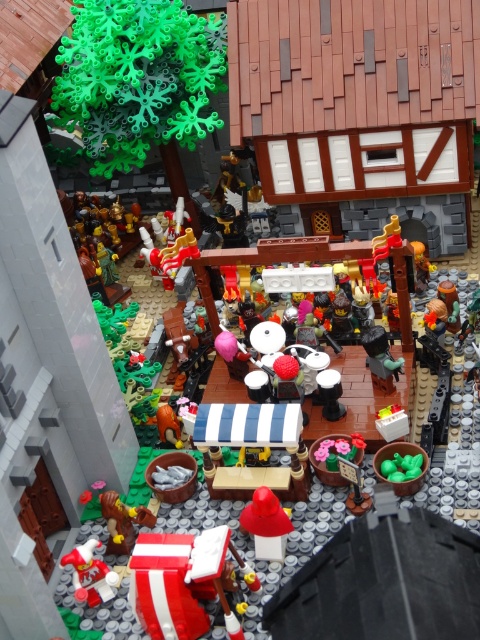
You are a Lego figure standing at the bottom left corner of the image. You need to place a new Lego piece at the exact center of the image. Which direction should you move to reach the location of the smooth red hat at center?

The smooth red hat at center is located at point [265,524], which is to the right and slightly above the exact center of the image. To reach it, you should move right and slightly upward from the bottom left corner.

You are a Lego figure standing at the edge of the market scene and want to hand an item to the vendor under the striped canopy tent. Which object should you pass first, the smooth red hat at center or the smooth brown wooden axe at lower left?

The smooth brown wooden axe at lower left should be passed first since the smooth red hat at center is positioned to its right, meaning the axe is closer to your current position at the edge of the market.

In the medieval fantasy Lego diorama, there are two red hats present. The first is a smooth red hat at center, and the second is a matte red santa hat at lower left. Which of these two hats is larger in size?

The smooth red hat at center is bigger than the matte red santa hat at lower left.